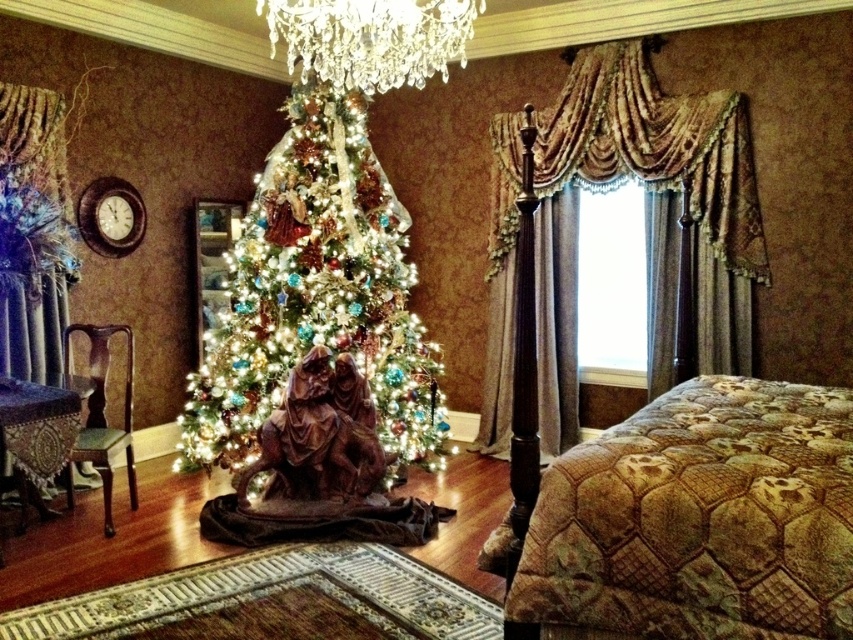
Question: Among these points, which one is nearest to the camera?

Choices:
 (A) (247, 401)
 (B) (735, 400)

Answer: (B)

Question: Which of these objects is positioned farthest from the crystal clear chandelier at upper center?

Choices:
 (A) iridescent glass christmas tree at center
 (B) brown quilted bed at right

Answer: (B)

Question: From the image, what is the correct spatial relationship of gold quilted bed at right in relation to crystal clear chandelier at upper center?

Choices:
 (A) below
 (B) above

Answer: (A)

Question: Can you confirm if brown quilted bed at right is positioned above iridescent glass christmas tree at center?

Choices:
 (A) no
 (B) yes

Answer: (A)

Question: Which point is farther to the camera?

Choices:
 (A) crystal clear chandelier at upper center
 (B) gold quilted bed at right
 (C) brown quilted bed at right

Answer: (B)

Question: Is the position of iridescent glass christmas tree at center more distant than that of gold quilted bed at right?

Choices:
 (A) yes
 (B) no

Answer: (B)